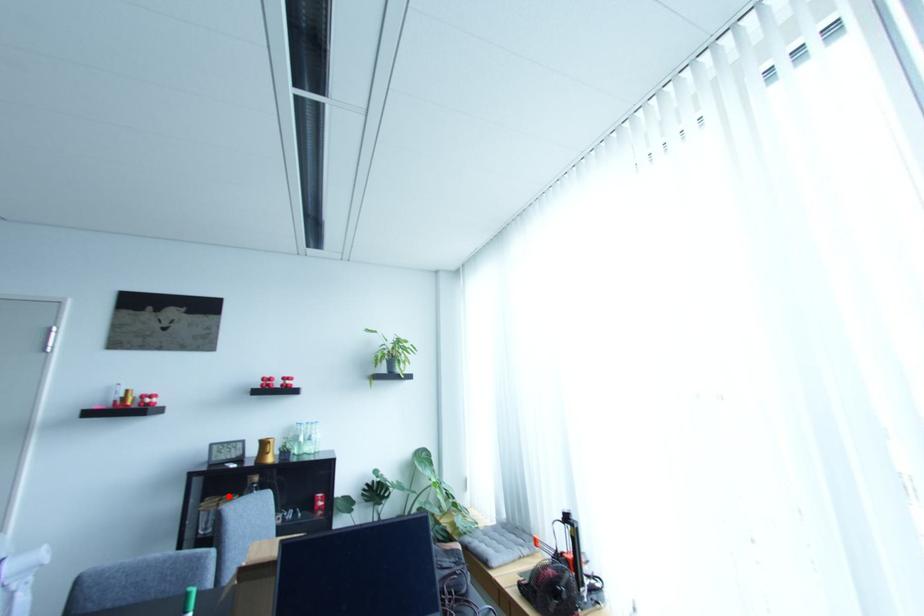
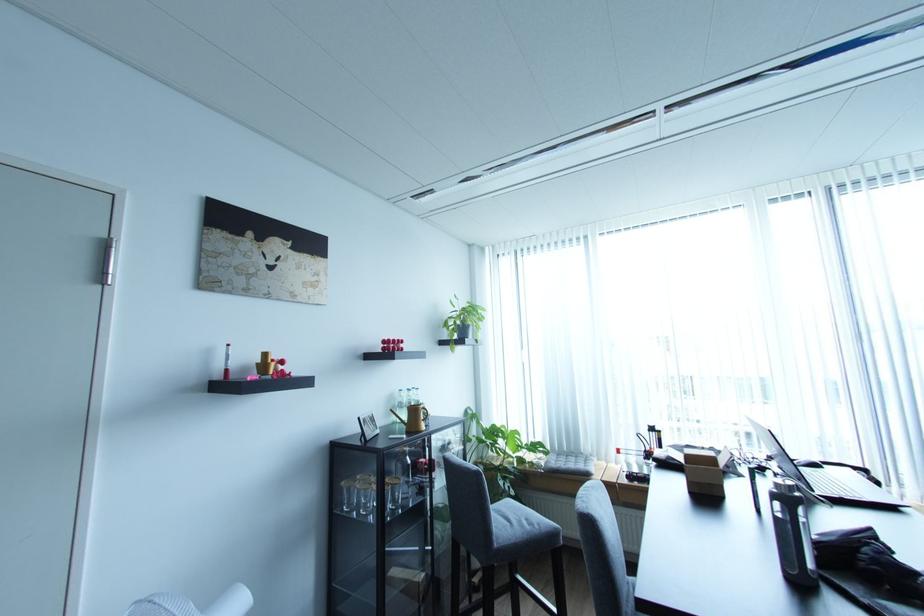
The point at the highlighted location is marked in the first image. Where is the corresponding point in the second image?

(361, 477)